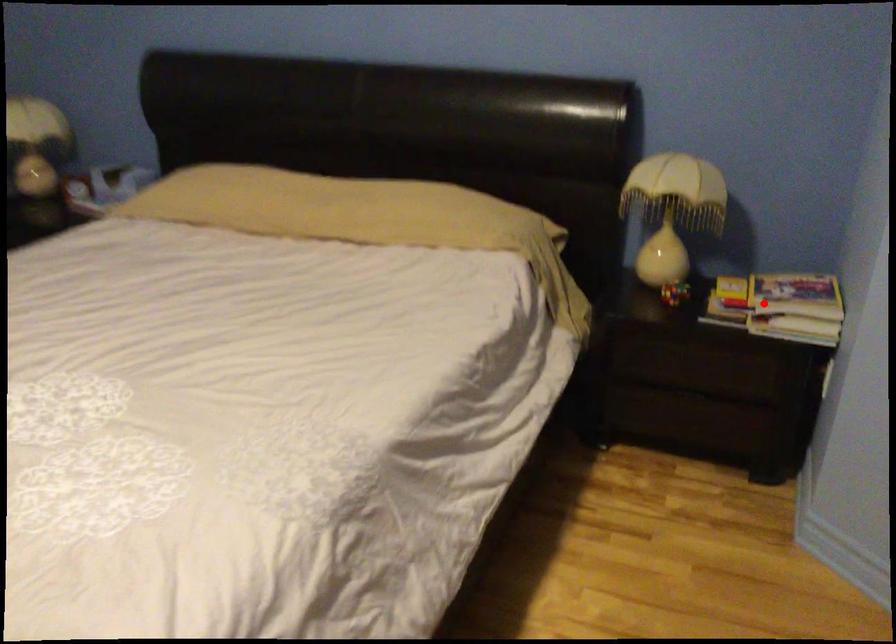
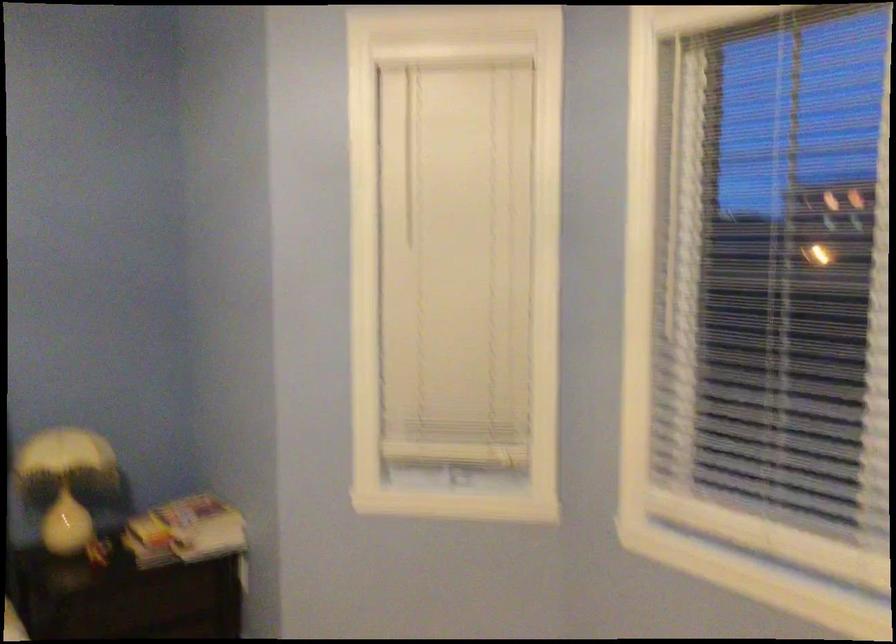
The point at the highlighted location is marked in the first image. Where is the corresponding point in the second image?

(185, 532)